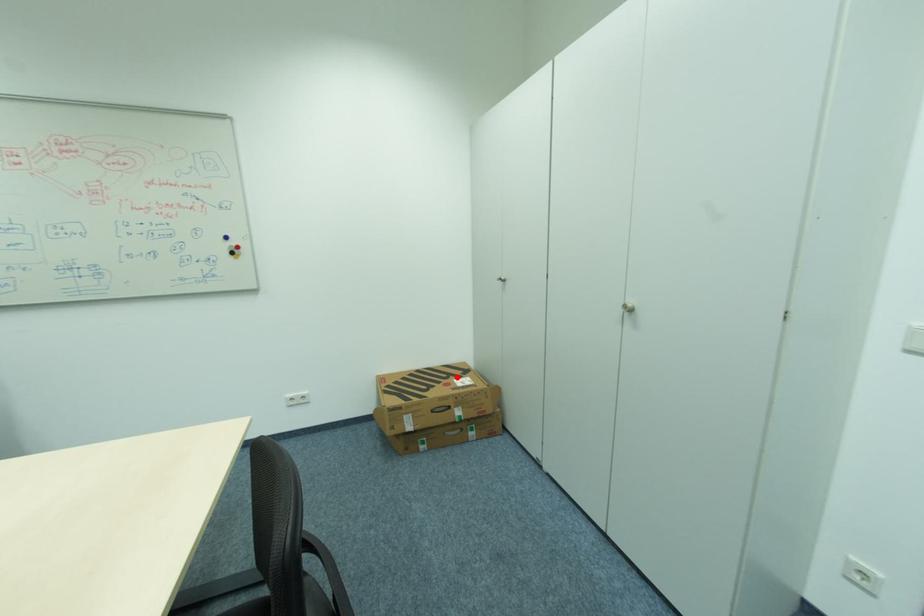
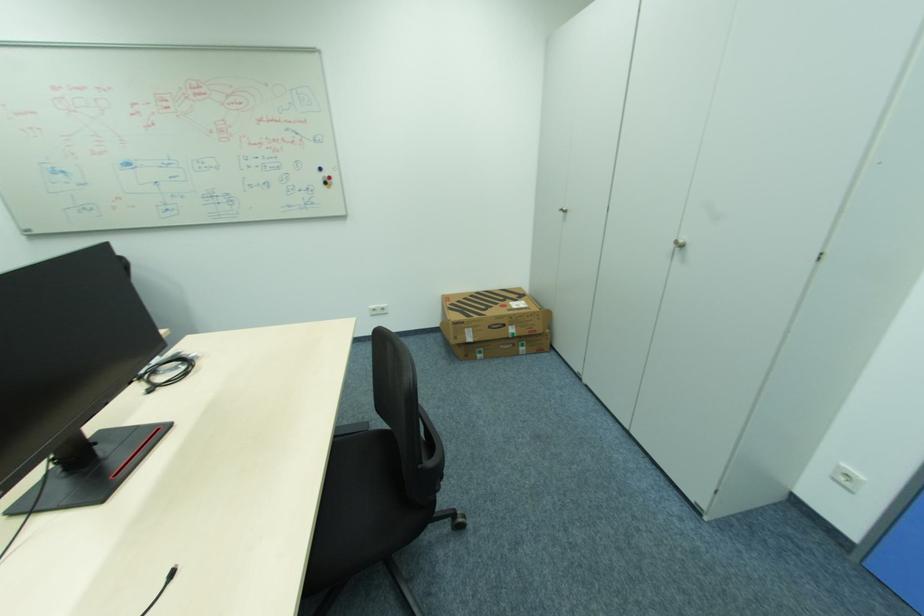
Find the pixel in the second image that matches the highlighted location in the first image.

(513, 300)